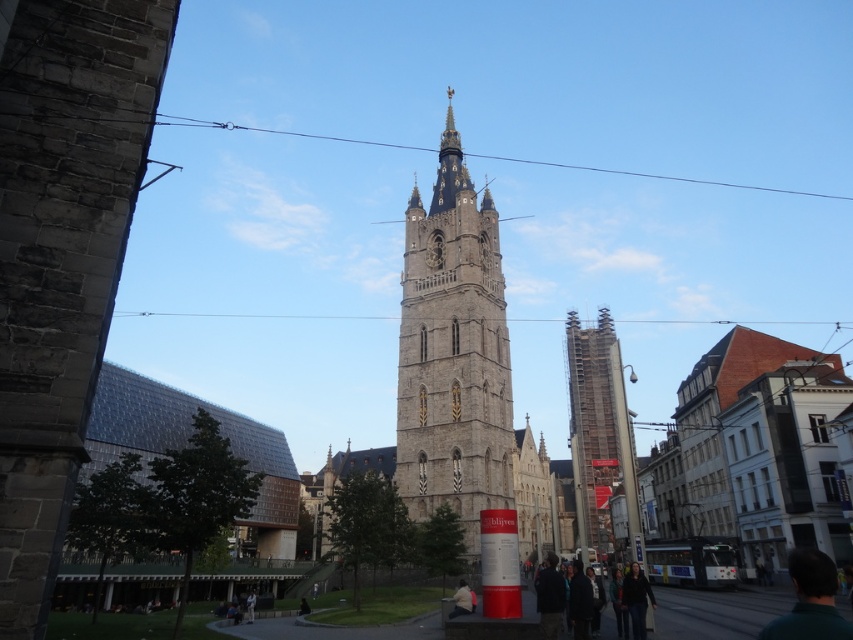
Between scaffolding wood at right and green matte shirt at lower right, which one is positioned higher?

Positioned higher is scaffolding wood at right.

Is scaffolding wood at right below green matte shirt at lower right?

No.

The height and width of the screenshot is (640, 853). Describe the element at coordinates (601, 432) in the screenshot. I see `scaffolding wood at right` at that location.

Locate an element on the screen. scaffolding wood at right is located at coordinates (x=601, y=432).

Is stone tower at center to the left of scaffolding wood at right from the viewer's perspective?

Indeed, stone tower at center is positioned on the left side of scaffolding wood at right.

Identify the location of stone tower at center. The height and width of the screenshot is (640, 853). tap(453, 352).

Does green matte shirt at lower right come behind dark gray sweater at lower right?

No.

Is point (834, 573) farther from viewer compared to point (622, 604)?

That is False.

Locate an element on the screen. The height and width of the screenshot is (640, 853). green matte shirt at lower right is located at coordinates (810, 600).

The image size is (853, 640). I want to click on green matte shirt at lower right, so click(810, 600).